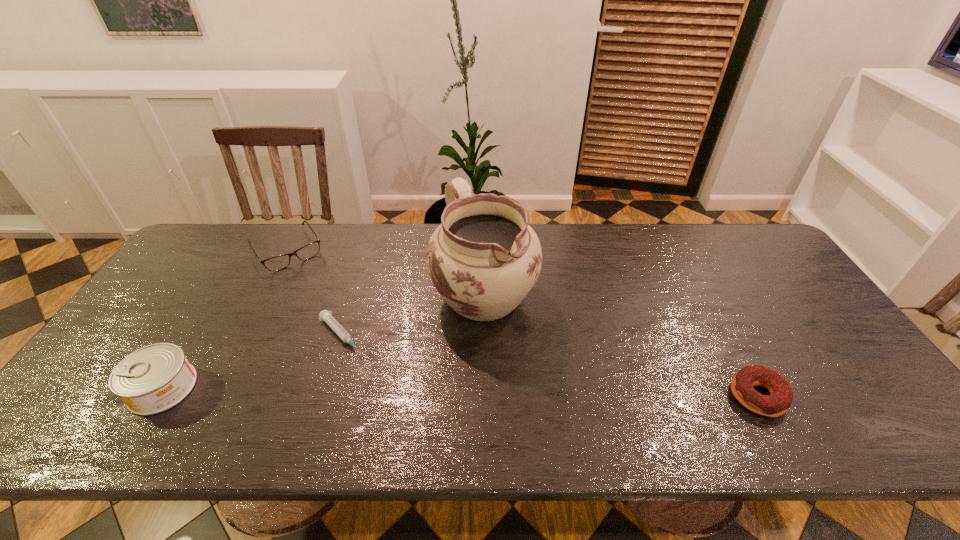
Where is `the fourth shortest object`? This screenshot has width=960, height=540. the fourth shortest object is located at coordinates (153, 379).

In order to click on the rightmost object in this screenshot , I will do `click(781, 395)`.

This screenshot has width=960, height=540. I want to click on the third object from right to left, so click(324, 315).

This screenshot has width=960, height=540. In order to click on syringe in this screenshot , I will do `click(324, 315)`.

Where is `spectacles`? spectacles is located at coordinates (279, 262).

At what (x,y) coordinates should I click in order to perform the action: click on pitcher. Please return your answer as a coordinate pair (x, y). The image size is (960, 540). Looking at the image, I should click on (484, 259).

Image resolution: width=960 pixels, height=540 pixels. Find the location of `the tallest object`. the tallest object is located at coordinates (484, 259).

Where is `vacant space situated on the right of the can`? vacant space situated on the right of the can is located at coordinates (270, 388).

This screenshot has width=960, height=540. Find the location of `vacant space situated on the right of the doughnut`. vacant space situated on the right of the doughnut is located at coordinates (810, 396).

This screenshot has width=960, height=540. Find the location of `vacant space located at the needle end of the syringe`. vacant space located at the needle end of the syringe is located at coordinates (382, 379).